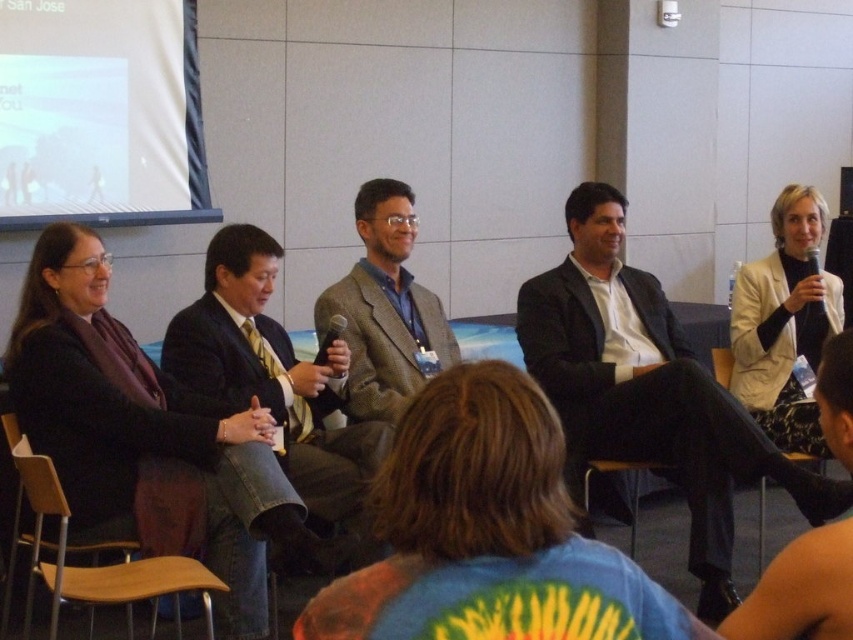
You are an attendee at the panel discussion. You want to take a photo of the white matte projection screen at upper left and the wooden at right. Which one is higher in the image?

The white matte projection screen at upper left is located above the wooden at right, so it is higher in the image.